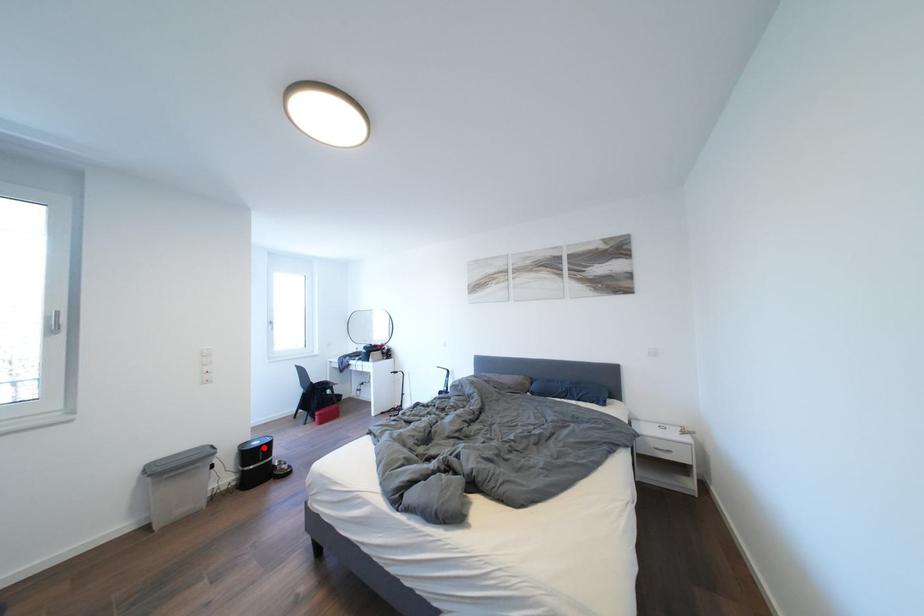
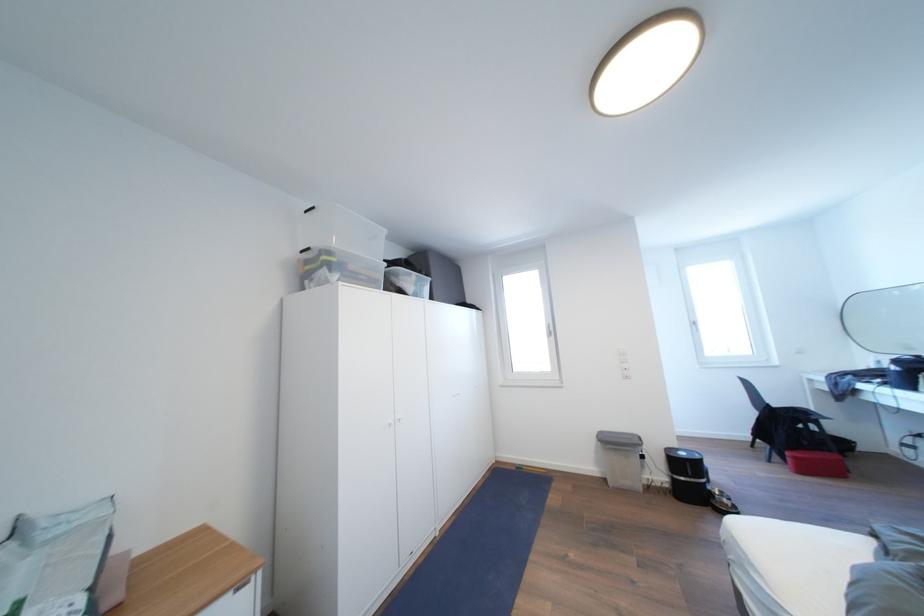
Where in the second image is the point corresponding to the highlighted location from the first image?

(689, 459)